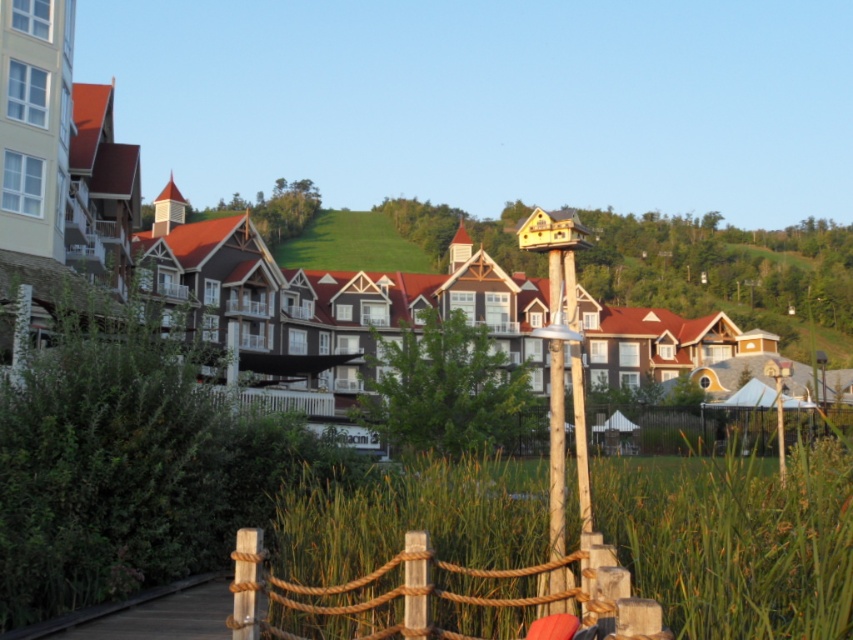
Is brown wooden houses at center wider than rope wood at center?

Yes, brown wooden houses at center is wider than rope wood at center.

Which is below, brown wooden houses at center or rope wood at center?

rope wood at center is below.

This screenshot has height=640, width=853. Identify the location of brown wooden houses at center. (521, 132).

Identify the location of brown wooden houses at center. This screenshot has width=853, height=640. (521, 132).

Does brown wooden fence at center appear on the left side of wooden post at center?

Incorrect, brown wooden fence at center is not on the left side of wooden post at center.

Can you confirm if brown wooden fence at center is bigger than wooden post at center?

Indeed, brown wooden fence at center has a larger size compared to wooden post at center.

Where is `brown wooden fence at center`? brown wooden fence at center is located at coordinates (703, 428).

Between rope wood at center and brown wooden fence at center, which one appears on the right side from the viewer's perspective?

brown wooden fence at center

Who is higher up, rope wood at center or brown wooden fence at center?

rope wood at center is above.

Measure the distance between rope wood at center and camera.

They are 11.10 meters apart.

Where is `rope wood at center`? This screenshot has height=640, width=853. rope wood at center is located at coordinates (433, 593).